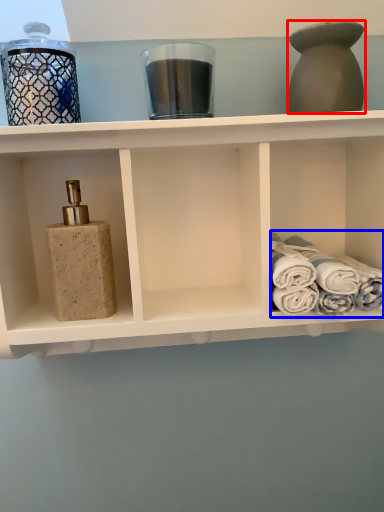
Question: Among these objects, which one is nearest to the camera, bottle (highlighted by a red box) or bath towel (highlighted by a blue box)?

Choices:
 (A) bottle
 (B) bath towel

Answer: (A)